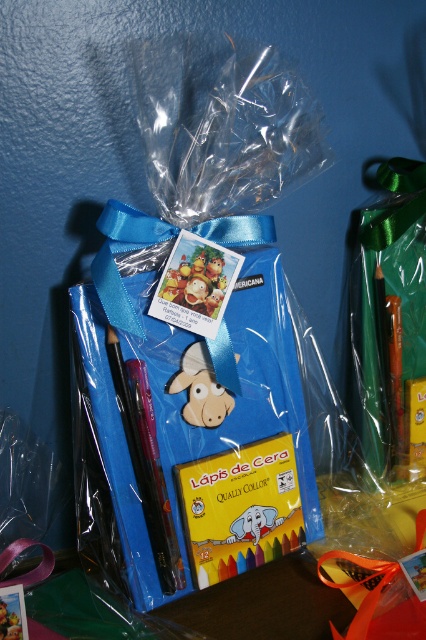
Question: Does wooden donkey at center appear over matte plastic toy at center?

Choices:
 (A) no
 (B) yes

Answer: (A)

Question: Which object appears closest to the camera in this image?

Choices:
 (A) matte plastic toy at center
 (B) wooden donkey at center

Answer: (A)

Question: Which object appears farthest from the camera in this image?

Choices:
 (A) matte plastic toy at center
 (B) wooden donkey at center

Answer: (B)

Question: Can you confirm if wooden donkey at center is positioned to the left of matte plastic toy at center?

Choices:
 (A) no
 (B) yes

Answer: (A)

Question: Among these objects, which one is farthest from the camera?

Choices:
 (A) wooden donkey at center
 (B) matte plastic toy at center

Answer: (A)

Question: Considering the relative positions of wooden donkey at center and matte plastic toy at center in the image provided, where is wooden donkey at center located with respect to matte plastic toy at center?

Choices:
 (A) right
 (B) left

Answer: (A)